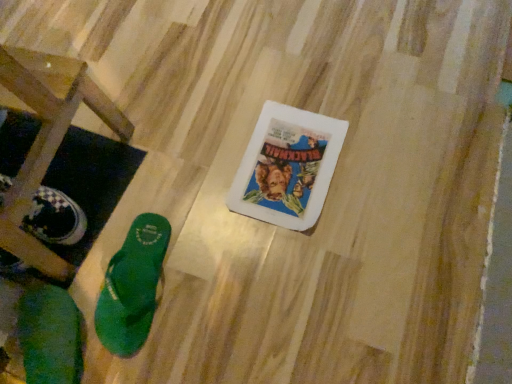
Question: Considering the relative positions of green rubber flip-flop at lower left, which is counted as the first footwear, starting from the right, and green fabric flip-flop at lower left, the second footwear viewed from the right, in the image provided, is green rubber flip-flop at lower left, which is counted as the first footwear, starting from the right, in front of green fabric flip-flop at lower left, the second footwear viewed from the right,?

Choices:
 (A) no
 (B) yes

Answer: (A)

Question: From the image's perspective, is green rubber flip-flop at lower left, acting as the 2th footwear starting from the left, located above green fabric flip-flop at lower left, positioned as the first footwear in left-to-right order?

Choices:
 (A) yes
 (B) no

Answer: (A)

Question: Does green rubber flip-flop at lower left, which is counted as the first footwear, starting from the right, turn towards green fabric flip-flop at lower left, positioned as the first footwear in left-to-right order?

Choices:
 (A) no
 (B) yes

Answer: (A)

Question: Are green rubber flip-flop at lower left, which is counted as the first footwear, starting from the right, and green fabric flip-flop at lower left, the second footwear viewed from the right, beside each other?

Choices:
 (A) no
 (B) yes

Answer: (A)

Question: Does green rubber flip-flop at lower left, which is counted as the first footwear, starting from the right, have a greater width compared to green fabric flip-flop at lower left, the second footwear viewed from the right?

Choices:
 (A) no
 (B) yes

Answer: (A)

Question: From a real-world perspective, is wooden stool at lower left physically located above or below green fabric flip-flop at lower left, positioned as the first footwear in left-to-right order?

Choices:
 (A) above
 (B) below

Answer: (A)

Question: Relative to green fabric flip-flop at lower left, the second footwear viewed from the right, is wooden stool at lower left in front or behind?

Choices:
 (A) front
 (B) behind

Answer: (A)

Question: From the image's perspective, is wooden stool at lower left positioned above or below green fabric flip-flop at lower left, positioned as the first footwear in left-to-right order?

Choices:
 (A) below
 (B) above

Answer: (B)

Question: Considering the positions of point (14, 225) and point (54, 304), is point (14, 225) closer or farther from the camera than point (54, 304)?

Choices:
 (A) closer
 (B) farther

Answer: (A)

Question: Looking at their shapes, would you say green fabric flip-flop at lower left, positioned as the first footwear in left-to-right order, is wider or thinner than wooden stool at lower left?

Choices:
 (A) thin
 (B) wide

Answer: (A)

Question: Looking at the image, does green fabric flip-flop at lower left, the second footwear viewed from the right, seem bigger or smaller compared to wooden stool at lower left?

Choices:
 (A) big
 (B) small

Answer: (B)

Question: From a real-world perspective, is green fabric flip-flop at lower left, the second footwear viewed from the right, positioned above or below wooden stool at lower left?

Choices:
 (A) above
 (B) below

Answer: (B)

Question: Is green fabric flip-flop at lower left, the second footwear viewed from the right, to the left or to the right of wooden stool at lower left in the image?

Choices:
 (A) right
 (B) left

Answer: (A)

Question: Is green rubber flip-flop at lower left, which is counted as the first footwear, starting from the right, taller or shorter than wooden stool at lower left?

Choices:
 (A) tall
 (B) short

Answer: (B)

Question: Does point (137, 218) appear closer or farther from the camera than point (51, 137)?

Choices:
 (A) farther
 (B) closer

Answer: (A)